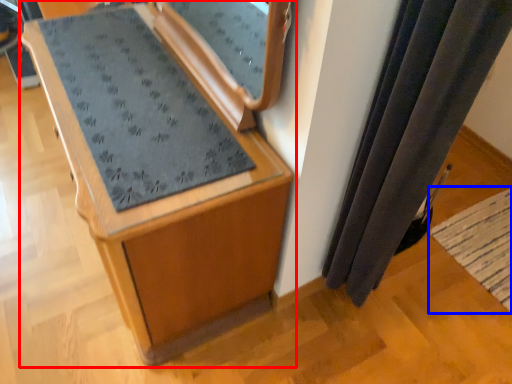
Question: Among these objects, which one is farthest to the camera, furniture (highlighted by a red box) or mat (highlighted by a blue box)?

Choices:
 (A) furniture
 (B) mat

Answer: (B)